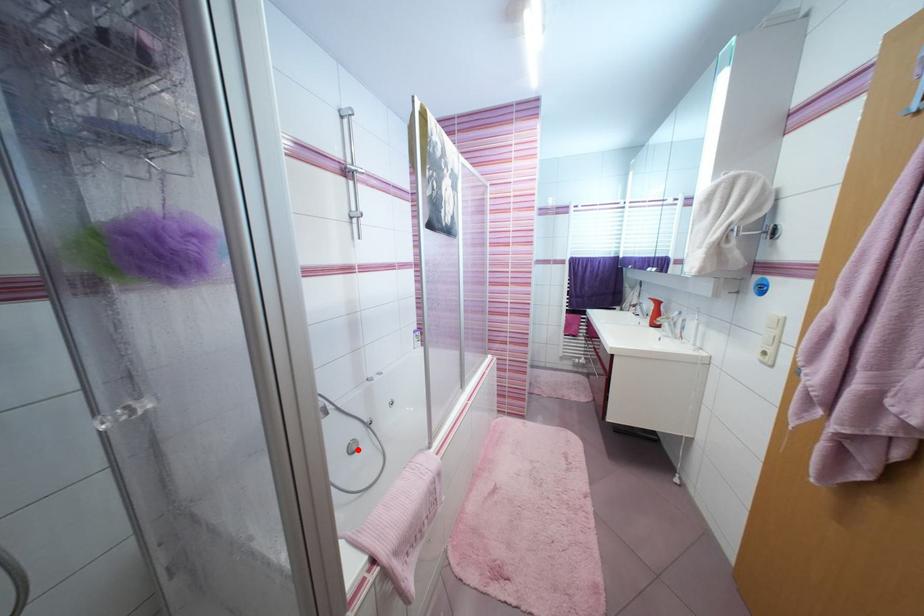
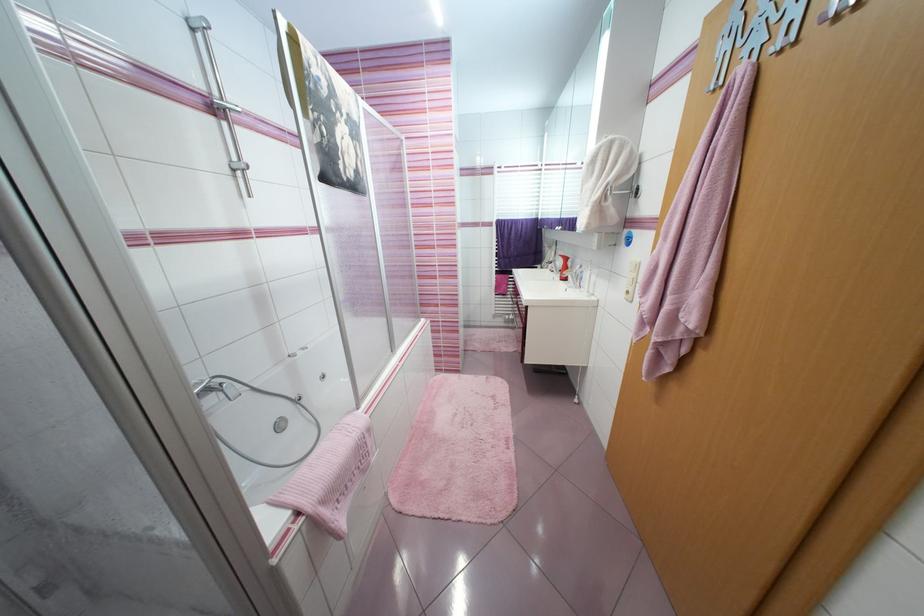
Where in the second image is the point corresponding to the highlighted location from the first image?

(286, 428)